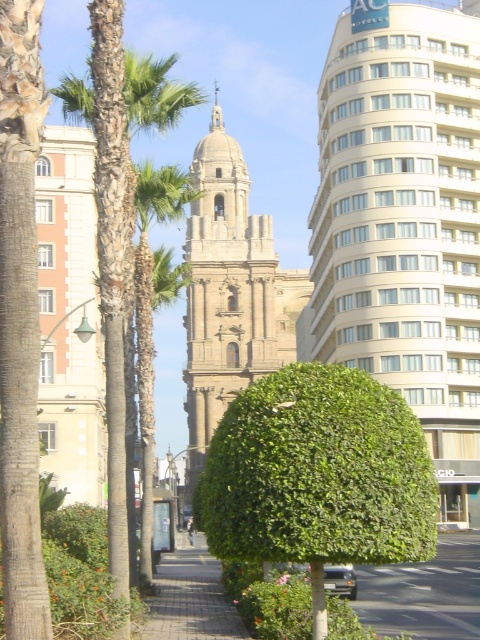
You are a city planner assessing the view from the main walkway. The white glass building at center and the green leafy palm tree at center are both visible from this vantage point. Which object appears closer to the viewer?

The white glass building at center appears closer to the viewer because the green leafy palm tree at center is positioned behind it.

You are a city planner assessing the space between two trees in the urban scene. The green leafy tree at left and the green leafy palm tree at left are both in the background. You need to install a bench that requires 50 feet of space between them. Will the current spacing accommodate the bench?

The distance between the green leafy tree at left and the green leafy palm tree at left is 53.61 feet, which is more than the required 50 feet. Therefore, the bench can be installed as the space is sufficient.